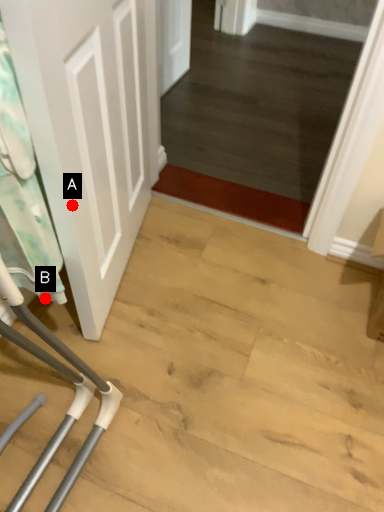
Question: Two points are circled on the image, labeled by A and B beside each circle. Among these points, which one is farthest from the camera?

Choices:
 (A) A is further
 (B) B is further

Answer: (B)